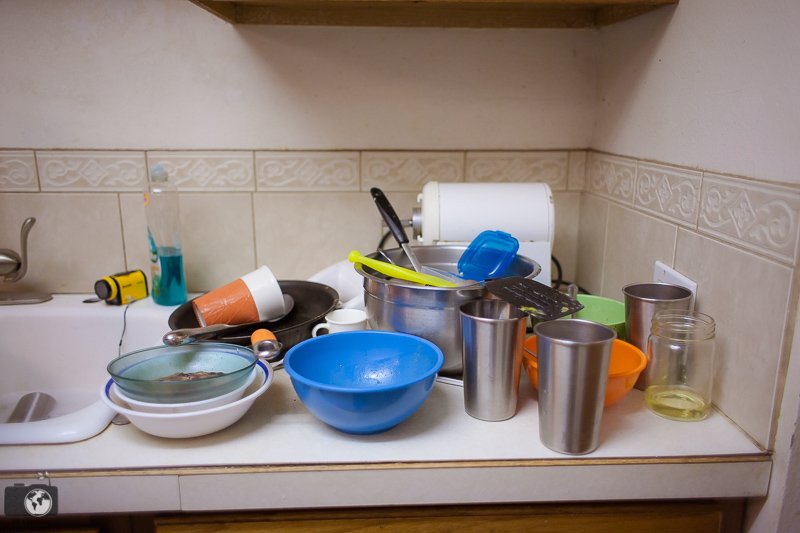
Find the location of `pot`. pot is located at coordinates (425, 310).